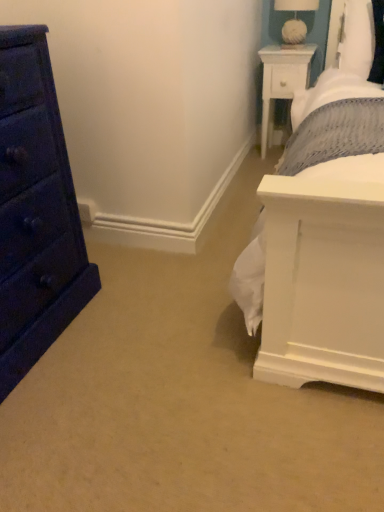
Where is `vacant point above white wood nightstand at upper right (from a real-world perspective)`? This screenshot has height=512, width=384. vacant point above white wood nightstand at upper right (from a real-world perspective) is located at coordinates (283, 46).